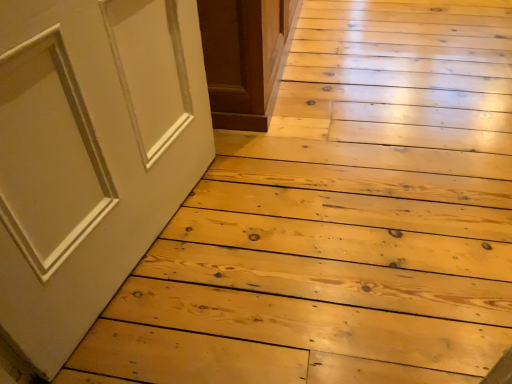
Identify the location of vacant space in front of white painted wood door at left. (174, 320).